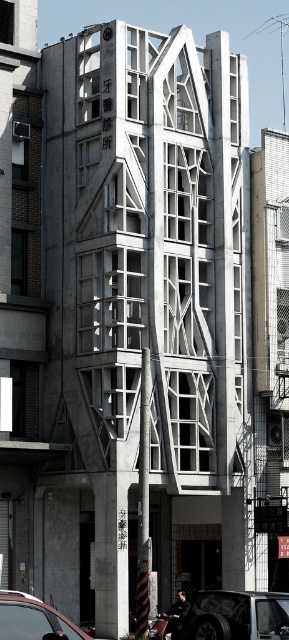
How far apart are black matte car at center and metallic silver car at lower left?

black matte car at center and metallic silver car at lower left are 14.08 meters apart from each other.

Does black matte car at center have a greater height compared to metallic silver car at lower left?

Correct, black matte car at center is much taller as metallic silver car at lower left.

Locate an element on the screen. This screenshot has height=640, width=289. black matte car at center is located at coordinates (236, 616).

This screenshot has height=640, width=289. I want to click on black matte car at center, so click(236, 616).